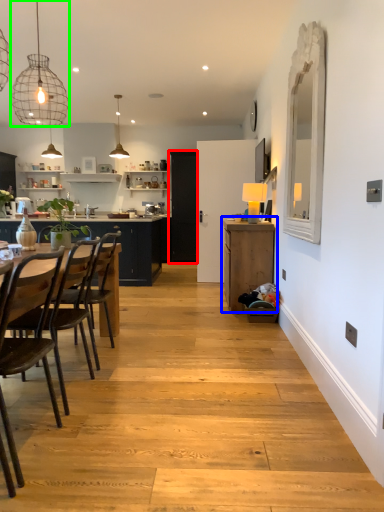
Question: Which object is the farthest from glass door (highlighted by a red box)? Choose among these: cabinetry (highlighted by a blue box) or light fixture (highlighted by a green box).

Choices:
 (A) cabinetry
 (B) light fixture

Answer: (A)